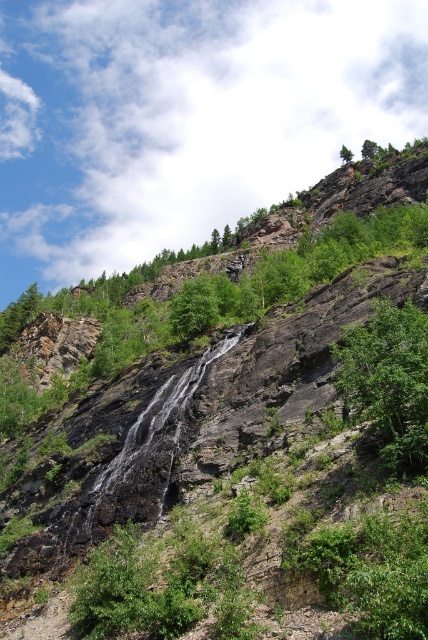
You are standing at the base of the cliff and want to reach the point marked at coordinates point (410, 388). Given that the cliff is steep and rocky, do you think it is safe to climb directly to that point?

The point marked at coordinates point (410, 388) is 46.67 meters away from the camera, which means it is quite far up the cliff. Considering the steep and rocky nature of the cliff, climbing directly to that point may be dangerous and not advisable without proper equipment and expertise.

You are a park ranger planning to install a safety barrier between the two green leafy trees. The barrier requires a minimum of 5 meters of space between the trees to be effective. Based on the distance between the green leafy tree at upper center and the green leafy tree at upper right, will the barrier be effective here?

→ The green leafy tree at upper center and green leafy tree at upper right are 5.67 meters apart, which exceeds the required 5 meters. Therefore, the barrier will be effective here.